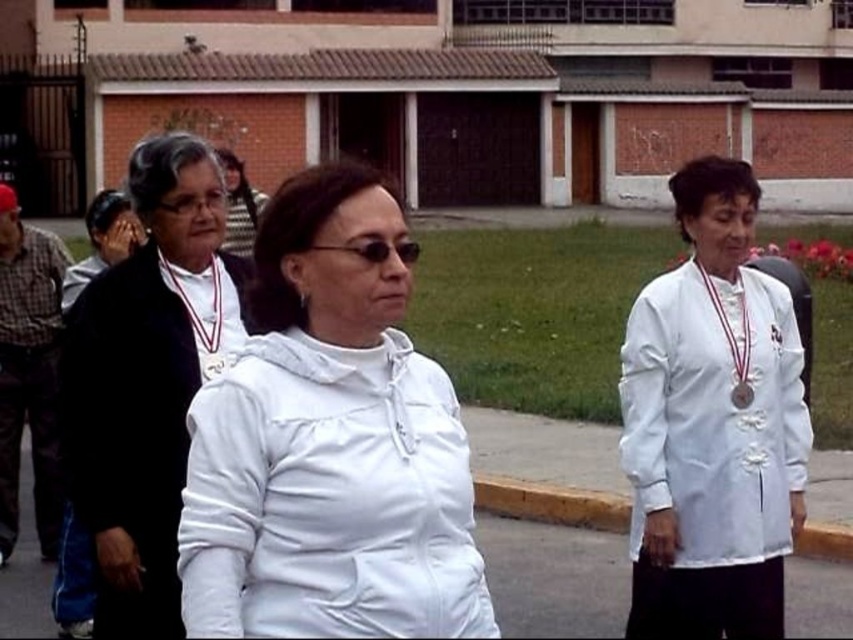
Who is more distant from viewer, (x=247, y=189) or (x=219, y=365)?

Point (x=247, y=189)

Image resolution: width=853 pixels, height=640 pixels. Describe the element at coordinates (239, 205) in the screenshot. I see `matte black jacket at upper center` at that location.

This screenshot has width=853, height=640. Identify the location of matte black jacket at upper center. (239, 205).

Which is more to the left, white matte lab coat at center or black plastic sunglasses at center?

Positioned to the left is black plastic sunglasses at center.

Can you confirm if white matte lab coat at center is taller than black plastic sunglasses at center?

Correct, white matte lab coat at center is much taller as black plastic sunglasses at center.

Locate an element on the screen. This screenshot has height=640, width=853. white matte lab coat at center is located at coordinates (712, 416).

Does white matte lab coat at center have a lesser width compared to silver metallic medal at center?

No, white matte lab coat at center is not thinner than silver metallic medal at center.

Looking at this image, is white matte lab coat at center bigger than silver metallic medal at center?

Correct, white matte lab coat at center is larger in size than silver metallic medal at center.

Is point (701, 480) positioned behind point (218, 362)?

Yes, point (701, 480) is farther from viewer.

Where is `white matte lab coat at center`? The height and width of the screenshot is (640, 853). white matte lab coat at center is located at coordinates (712, 416).